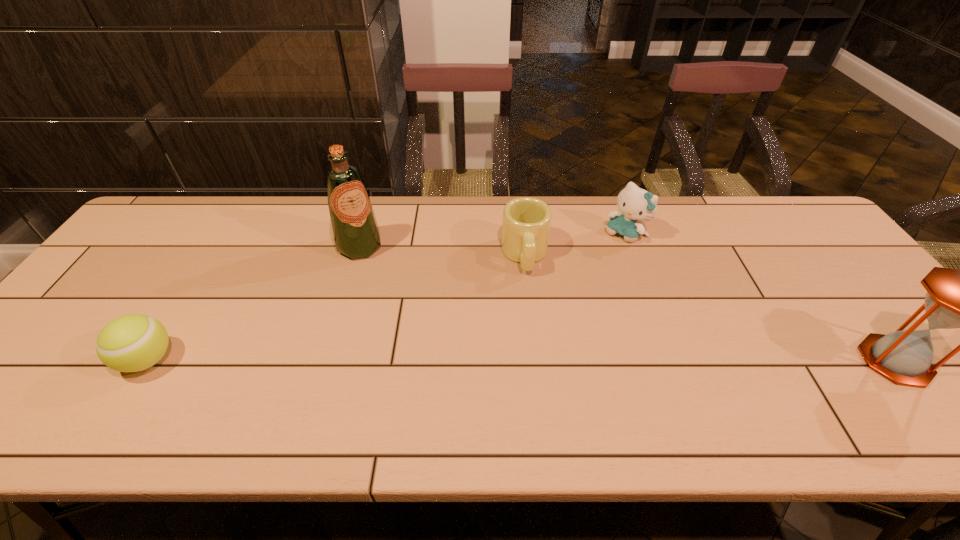
At what (x,y) coordinates should I click in order to perform the action: click on the leftmost object. Please return your answer as a coordinate pair (x, y). Image resolution: width=960 pixels, height=540 pixels. Looking at the image, I should click on (131, 343).

Where is `the rightmost object`? This screenshot has height=540, width=960. the rightmost object is located at coordinates (956, 298).

Where is `hourglass`? hourglass is located at coordinates (956, 298).

I want to click on the fourth object from right to left, so click(x=356, y=233).

Where is `the tallest object`? The image size is (960, 540). the tallest object is located at coordinates (356, 233).

At what (x,y) coordinates should I click in order to perform the action: click on kitten. Please return your answer as a coordinate pair (x, y). The image size is (960, 540). Looking at the image, I should click on (635, 204).

Identify the location of the third tallest object. (635, 204).

Locate an element on the screen. Image resolution: width=960 pixels, height=540 pixels. the third object from right to left is located at coordinates (526, 225).

This screenshot has height=540, width=960. I want to click on vacant space located 0.120m on the back of the tennis ball, so click(x=186, y=300).

At what (x,y) coordinates should I click in order to perform the action: click on vacant area located 0.230m on the back of the hourglass. Please return your answer as a coordinate pair (x, y). Looking at the image, I should click on (823, 269).